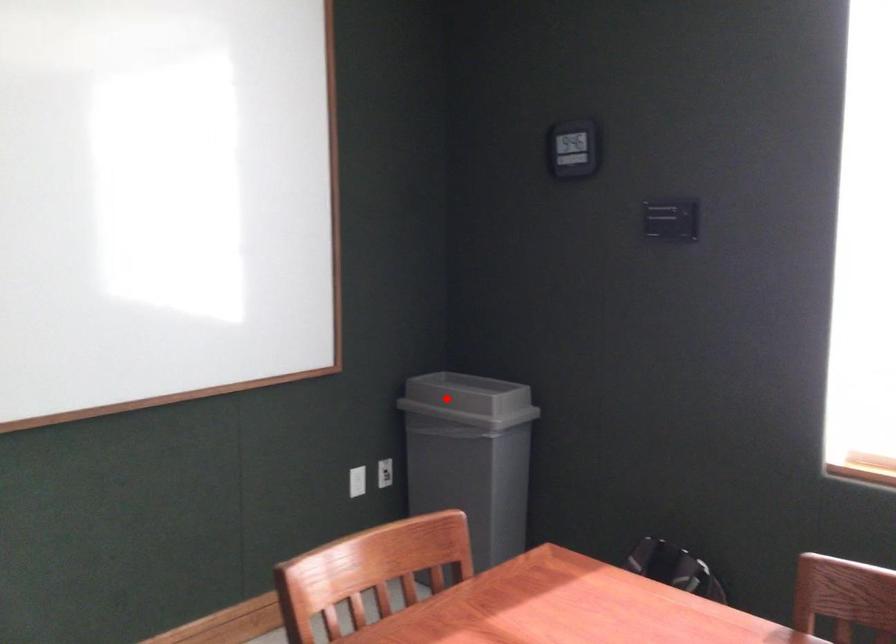
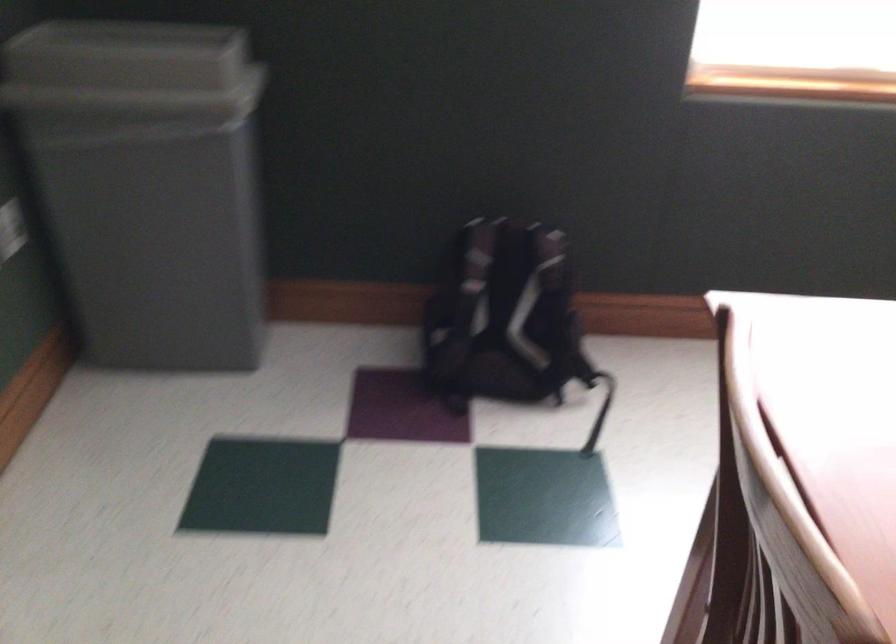
Where in the second image is the point corresponding to the highlighted location from the first image?

(131, 71)